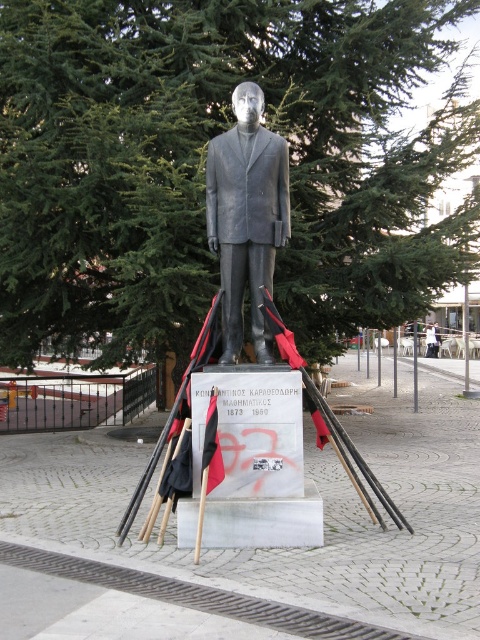
Question: Which object appears farthest from the camera in this image?

Choices:
 (A) bronze statue at center
 (B) green needle-like leaves at center

Answer: (B)

Question: Is green needle-like leaves at center above bronze statue at center?

Choices:
 (A) yes
 (B) no

Answer: (B)

Question: Can you confirm if green needle-like leaves at center is positioned below bronze statue at center?

Choices:
 (A) no
 (B) yes

Answer: (B)

Question: Is green needle-like leaves at center smaller than bronze statue at center?

Choices:
 (A) yes
 (B) no

Answer: (A)

Question: Which point is closer to the camera?

Choices:
 (A) green needle-like leaves at center
 (B) bronze statue at center

Answer: (B)